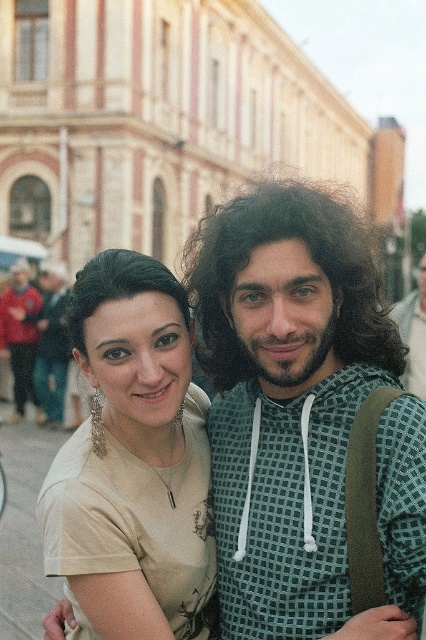
Which of these two, matte beige shirt at center or beige fabric shirt at center, stands taller?

Standing taller between the two is matte beige shirt at center.

Does point (333, 586) come closer to viewer compared to point (178, 353)?

Yes, it is.

Image resolution: width=426 pixels, height=640 pixels. In order to click on matte beige shirt at center in this screenshot , I will do `click(287, 394)`.

Does beige fabric shirt at center have a smaller size compared to dark brown shiny hair at upper left?

Yes.

Does beige fabric shirt at center appear over dark brown shiny hair at upper left?

Actually, beige fabric shirt at center is below dark brown shiny hair at upper left.

Who is more distant from viewer, (184, 358) or (132, 289)?

Positioned behind is point (184, 358).

Locate an element on the screen. The height and width of the screenshot is (640, 426). beige fabric shirt at center is located at coordinates (134, 460).

Who is higher up, curly brown hair at center or dark brown shiny hair at upper left?

curly brown hair at center is above.

Can you confirm if curly brown hair at center is smaller than dark brown shiny hair at upper left?

A: Actually, curly brown hair at center might be larger than dark brown shiny hair at upper left.

Which is behind, point (215, 294) or point (111, 268)?

Point (215, 294)

Find the location of `curly brown hair at center`. curly brown hair at center is located at coordinates (311, 259).